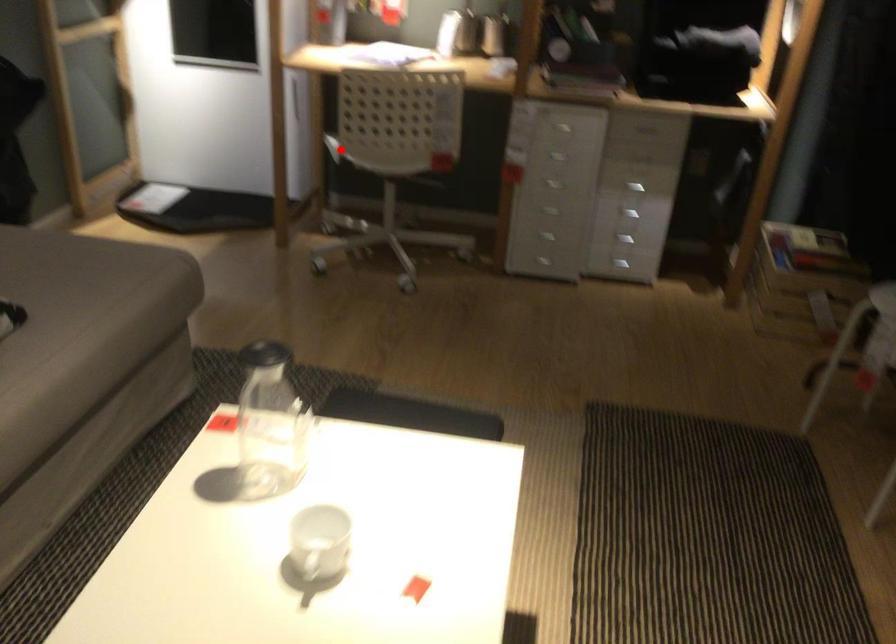
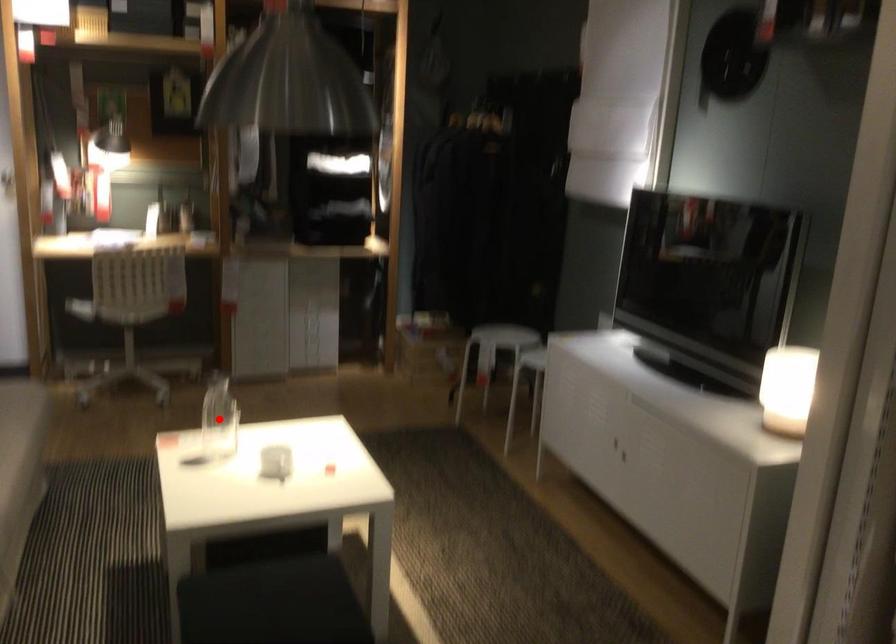
I am providing you with two images of the same scene from different viewpoints. A red point is marked on the first image and another point is marked on the second image. Is the red point in image1 aligned with the point shown in image2?

No